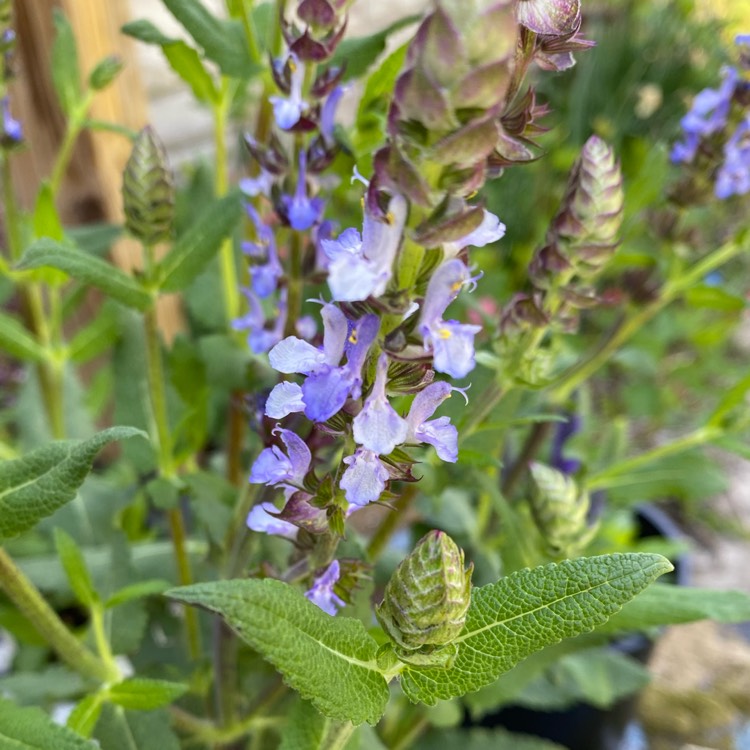
Where is `bulb`? The image size is (750, 750). bulb is located at coordinates (417, 610).